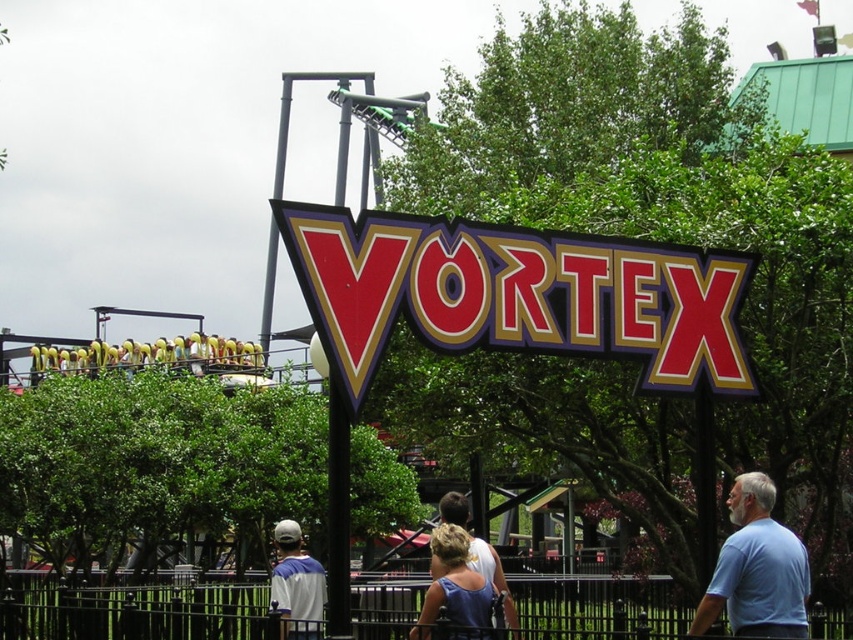
From the picture: Between shiny red sign at center and white jersey at lower left, which one is positioned higher?

Positioned higher is shiny red sign at center.

Who is more distant from viewer, (497, 275) or (305, 611)?

Positioned behind is point (305, 611).

Where is `shiny red sign at center`? Image resolution: width=853 pixels, height=640 pixels. shiny red sign at center is located at coordinates (514, 292).

Which is in front, point (715, 326) or point (758, 568)?

Point (758, 568) is more forward.

The height and width of the screenshot is (640, 853). In order to click on shiny red sign at center in this screenshot , I will do `click(514, 292)`.

Does point (122, 602) lie in front of point (730, 508)?

No, (122, 602) is behind (730, 508).

Is black metal fence at lower center bigger than light blue t-shirt at lower right?

Correct, black metal fence at lower center is larger in size than light blue t-shirt at lower right.

Is point (202, 636) positioned in front of point (769, 568)?

No.

Find the location of a particular element. This screenshot has width=853, height=640. black metal fence at lower center is located at coordinates (128, 609).